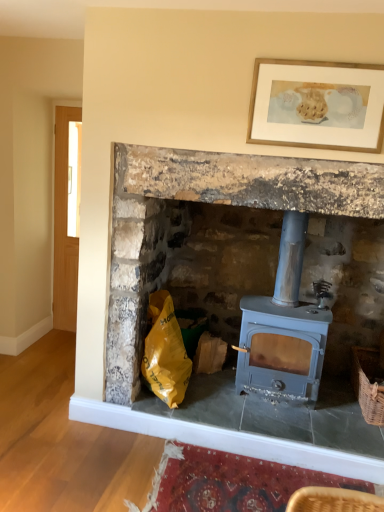
Measure the distance between point (372, 393) and camera.

Point (372, 393) and camera are 2.52 meters apart from each other.

Describe the element at coordinates (245, 294) in the screenshot. I see `matte gray wood stove at center` at that location.

Describe the element at coordinates (316, 104) in the screenshot. The image size is (384, 512). I see `wooden-framed artwork at upper center` at that location.

Identify the location of yellow plastic bag at lower left. (165, 352).

Considering the sizes of matte gray wood stove at center and yellow plastic bag at lower left in the image, is matte gray wood stove at center wider or thinner than yellow plastic bag at lower left?

Considering their sizes, matte gray wood stove at center looks broader than yellow plastic bag at lower left.

Is matte gray wood stove at center to the right of yellow plastic bag at lower left from the viewer's perspective?

Yes.

How far apart are matte gray wood stove at center and yellow plastic bag at lower left?

matte gray wood stove at center and yellow plastic bag at lower left are 17.95 inches apart from each other.

What's the angular difference between matte gray wood stove at center and yellow plastic bag at lower left's facing directions?

2.86 degrees separate the facing orientations of matte gray wood stove at center and yellow plastic bag at lower left.

From their relative heights in the image, would you say yellow plastic bag at lower left is taller or shorter than matte gray wood stove at center?

Considering their sizes, yellow plastic bag at lower left has less height than matte gray wood stove at center.

In the scene shown: From a real-world perspective, is yellow plastic bag at lower left above or below matte gray wood stove at center?

From a real-world perspective, yellow plastic bag at lower left is physically below matte gray wood stove at center.

Considering the relative sizes of yellow plastic bag at lower left and matte gray wood stove at center in the image provided, is yellow plastic bag at lower left bigger than matte gray wood stove at center?

Incorrect, yellow plastic bag at lower left is not larger than matte gray wood stove at center.

From a real-world perspective, is matte blue wood burning stove at center positioned above or below woven brown basket at lower right?

From a real-world perspective, matte blue wood burning stove at center is physically above woven brown basket at lower right.

Is point (303, 365) closer or farther from the camera than point (373, 417)?

Point (303, 365) is farther from the camera than point (373, 417).

This screenshot has height=512, width=384. Identify the location of wood burning stove positioned vertically above the woven brown basket at lower right (from a real-world perspective). (283, 328).

In the scene shown: Between wooden-framed artwork at upper center and matte blue wood burning stove at center, which one is positioned behind?

matte blue wood burning stove at center.

How distant is wooden-framed artwork at upper center from matte blue wood burning stove at center?

They are 39.30 inches apart.

Who is bigger, wooden-framed artwork at upper center or matte blue wood burning stove at center?

matte blue wood burning stove at center is bigger.

Find the location of `wood burning stove on the right side of wooden-framed artwork at upper center`. wood burning stove on the right side of wooden-framed artwork at upper center is located at coordinates (283, 328).

In the image, there is a matte blue wood burning stove at center. Identify the location of material below it (from a real-world perspective). This screenshot has width=384, height=512. [x=165, y=352].

Which is closer to the camera, (145, 362) or (265, 339)?

The point (145, 362) is in front.

Is yellow plastic bag at lower left inside or outside of matte blue wood burning stove at center?

The correct answer is: outside.

From the image's perspective, relative to matte blue wood burning stove at center, is yellow plastic bag at lower left above or below?

From the image's perspective, yellow plastic bag at lower left appears below matte blue wood burning stove at center.

Is woven brown basket at lower right aimed at wooden-framed artwork at upper center?

No, woven brown basket at lower right is not oriented towards wooden-framed artwork at upper center.

Is woven brown basket at lower right not close to wooden-framed artwork at upper center?

Yes, woven brown basket at lower right and wooden-framed artwork at upper center are quite far apart.

The height and width of the screenshot is (512, 384). In order to click on basket that is on the right side of wooden-framed artwork at upper center in this screenshot , I will do `click(368, 384)`.

Which object is closer to the camera, matte blue wood burning stove at center or wooden-framed artwork at upper center?

wooden-framed artwork at upper center is more forward.

From the image's perspective, which one is positioned higher, matte blue wood burning stove at center or wooden-framed artwork at upper center?

wooden-framed artwork at upper center appears higher in the image.

Is matte blue wood burning stove at center looking in the opposite direction of wooden-framed artwork at upper center?

That's not correct — matte blue wood burning stove at center is not looking away from wooden-framed artwork at upper center.

Which object is positioned more to the left, matte blue wood burning stove at center or wooden-framed artwork at upper center?

wooden-framed artwork at upper center is more to the left.

Where is `fireplace that is in front of the yellow plastic bag at lower left`? The height and width of the screenshot is (512, 384). fireplace that is in front of the yellow plastic bag at lower left is located at coordinates (245, 294).

I want to click on fireplace above the yellow plastic bag at lower left (from a real-world perspective), so click(245, 294).

Which object lies nearer to the anchor point wooden-framed artwork at upper center, woven brown basket at lower right or matte gray wood stove at center?

Among the two, matte gray wood stove at center is located nearer to wooden-framed artwork at upper center.

When comparing their distances from yellow plastic bag at lower left, does woven brown basket at lower right or matte blue wood burning stove at center seem further?

Among the two, woven brown basket at lower right is located further to yellow plastic bag at lower left.

From the image, which object appears to be farther from yellow plastic bag at lower left, wooden-framed artwork at upper center or matte blue wood burning stove at center?

wooden-framed artwork at upper center.

Based on their spatial positions, is yellow plastic bag at lower left or wooden-framed artwork at upper center further from woven brown basket at lower right?

wooden-framed artwork at upper center is further to woven brown basket at lower right.

Estimate the real-world distances between objects in this image. Which object is closer to matte blue wood burning stove at center, matte gray wood stove at center or woven brown basket at lower right?

Among the two, matte gray wood stove at center is located nearer to matte blue wood burning stove at center.

From the image, which object appears to be farther from woven brown basket at lower right, yellow plastic bag at lower left or matte blue wood burning stove at center?

Based on the image, yellow plastic bag at lower left appears to be further to woven brown basket at lower right.

When comparing their distances from wooden-framed artwork at upper center, does matte blue wood burning stove at center or matte gray wood stove at center seem further?

matte blue wood burning stove at center is further to wooden-framed artwork at upper center.

Based on their spatial positions, is yellow plastic bag at lower left or woven brown basket at lower right closer to matte gray wood stove at center?

yellow plastic bag at lower left is positioned closer to the anchor matte gray wood stove at center.

Where is `fireplace situated between yellow plastic bag at lower left and woven brown basket at lower right from left to right`? fireplace situated between yellow plastic bag at lower left and woven brown basket at lower right from left to right is located at coordinates (245, 294).

Image resolution: width=384 pixels, height=512 pixels. In order to click on material that lies between wooden-framed artwork at upper center and woven brown basket at lower right from top to bottom in this screenshot , I will do `click(165, 352)`.

The image size is (384, 512). Find the location of `fireplace between wooden-framed artwork at upper center and matte blue wood burning stove at center in the vertical direction`. fireplace between wooden-framed artwork at upper center and matte blue wood burning stove at center in the vertical direction is located at coordinates (245, 294).

This screenshot has width=384, height=512. I want to click on wood burning stove between wooden-framed artwork at upper center and yellow plastic bag at lower left from top to bottom, so click(x=283, y=328).